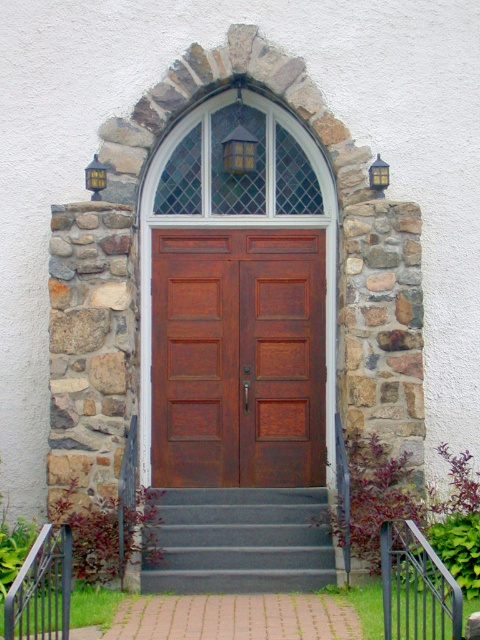
Question: Is gray carpeted stairs at center wider than black metal/rail at lower right?

Choices:
 (A) yes
 (B) no

Answer: (A)

Question: Can you confirm if gray carpeted stairs at center is positioned to the right of black metal/rail at lower left?

Choices:
 (A) yes
 (B) no

Answer: (A)

Question: Which object is closer to the camera taking this photo?

Choices:
 (A) gray carpeted stairs at center
 (B) brown wooden door at center
 (C) black metal/rail at lower left

Answer: (C)

Question: Which point is closer to the camera?

Choices:
 (A) (60, 608)
 (B) (272, 500)
 (C) (305, 376)

Answer: (A)

Question: Considering the relative positions of gray carpeted stairs at center and black metal/rail at lower left in the image provided, where is gray carpeted stairs at center located with respect to black metal/rail at lower left?

Choices:
 (A) above
 (B) below

Answer: (B)

Question: Among these points, which one is nearest to the camera?

Choices:
 (A) (452, 579)
 (B) (180, 492)
 (C) (197, 250)

Answer: (A)